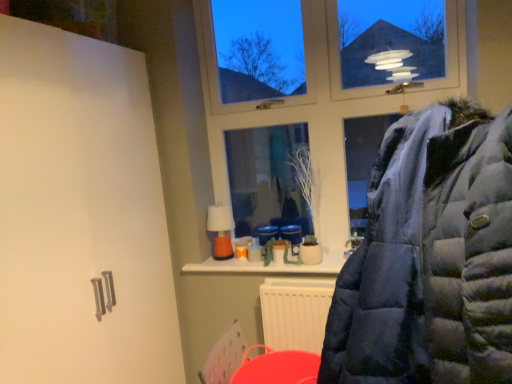
Question: Considering the relative sizes of rubberized plastic bucket at lower center and dark blue puffer jacket at center in the image provided, is rubberized plastic bucket at lower center thinner than dark blue puffer jacket at center?

Choices:
 (A) no
 (B) yes

Answer: (B)

Question: Is rubberized plastic bucket at lower center closer to camera compared to dark blue puffer jacket at center?

Choices:
 (A) no
 (B) yes

Answer: (A)

Question: Considering the relative sizes of rubberized plastic bucket at lower center and dark blue puffer jacket at center in the image provided, is rubberized plastic bucket at lower center smaller than dark blue puffer jacket at center?

Choices:
 (A) yes
 (B) no

Answer: (A)

Question: From the image's perspective, does rubberized plastic bucket at lower center appear lower than dark blue puffer jacket at center?

Choices:
 (A) no
 (B) yes

Answer: (B)

Question: Does rubberized plastic bucket at lower center lie behind dark blue puffer jacket at center?

Choices:
 (A) no
 (B) yes

Answer: (B)

Question: Is rubberized plastic bucket at lower center at the right side of dark blue puffer jacket at center?

Choices:
 (A) yes
 (B) no

Answer: (B)

Question: Considering the relative sizes of transparent glass window at upper center and rubberized plastic bucket at lower center in the image provided, is transparent glass window at upper center smaller than rubberized plastic bucket at lower center?

Choices:
 (A) yes
 (B) no

Answer: (B)

Question: From the image's perspective, is transparent glass window at upper center located above rubberized plastic bucket at lower center?

Choices:
 (A) yes
 (B) no

Answer: (A)

Question: Is transparent glass window at upper center surrounding rubberized plastic bucket at lower center?

Choices:
 (A) no
 (B) yes

Answer: (A)

Question: Can you confirm if transparent glass window at upper center is bigger than rubberized plastic bucket at lower center?

Choices:
 (A) no
 (B) yes

Answer: (B)

Question: From a real-world perspective, does transparent glass window at upper center sit lower than rubberized plastic bucket at lower center?

Choices:
 (A) no
 (B) yes

Answer: (A)

Question: Can you confirm if transparent glass window at upper center is thinner than rubberized plastic bucket at lower center?

Choices:
 (A) yes
 (B) no

Answer: (A)

Question: Can we say dark blue puffer jacket at center lies outside transparent glass window at upper center?

Choices:
 (A) yes
 (B) no

Answer: (A)